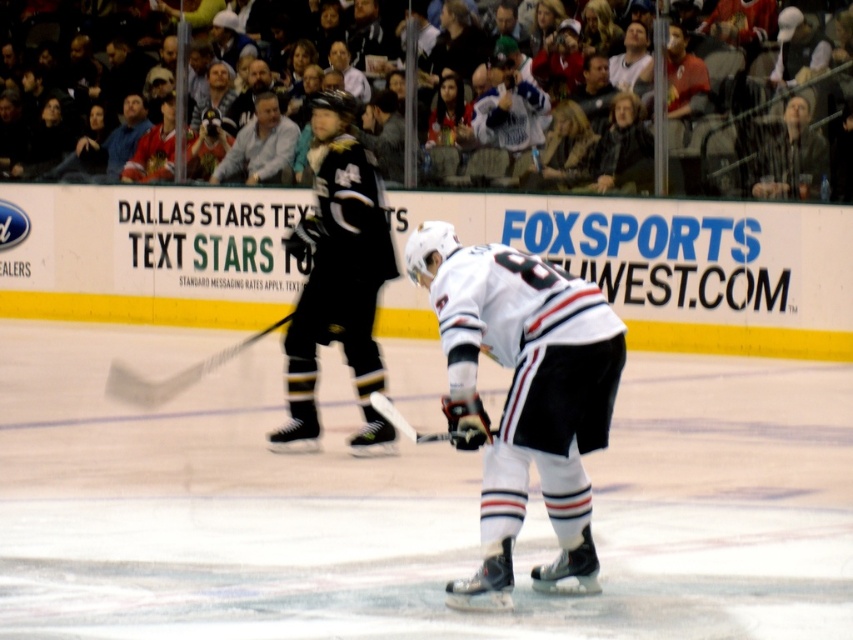
You are a referee in an ice hockey game. You need to determine if the white matte jersey at center is above or below the black matte jersey at center. Based on the scene, what is your observation?

The white matte jersey at center is below the black matte jersey at center according to the description.

You are a photographer trying to capture a closeup shot of both the white matte jersey at center and the black matte jersey at center during the game. If your camera frame can only accommodate the width of the wider jersey, will both jerseys fit in the frame?

Result: The white matte jersey at center has a larger width than the black matte jersey at center. Since the camera frame can accommodate the width of the wider jersey, both jerseys will fit in the frame as the white matte jersey at center is the wider one.